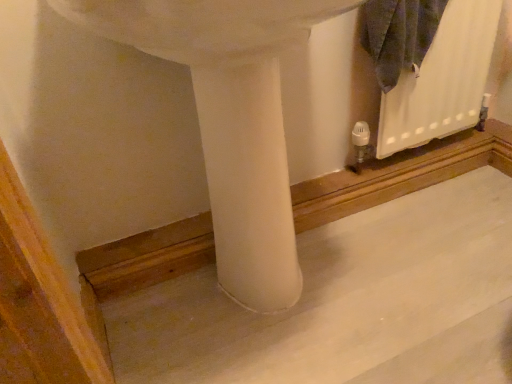
Question: Visually, is smooth concrete at center positioned to the left or to the right of white matte radiator at upper right?

Choices:
 (A) left
 (B) right

Answer: (A)

Question: In terms of height, does smooth concrete at center look taller or shorter compared to white matte radiator at upper right?

Choices:
 (A) short
 (B) tall

Answer: (A)

Question: Which object is positioned closest to the white matte radiator at upper right?

Choices:
 (A) smooth concrete at center
 (B) white matte sink at center

Answer: (A)

Question: Which object is positioned farthest from the smooth concrete at center?

Choices:
 (A) white matte sink at center
 (B) white matte radiator at upper right

Answer: (B)